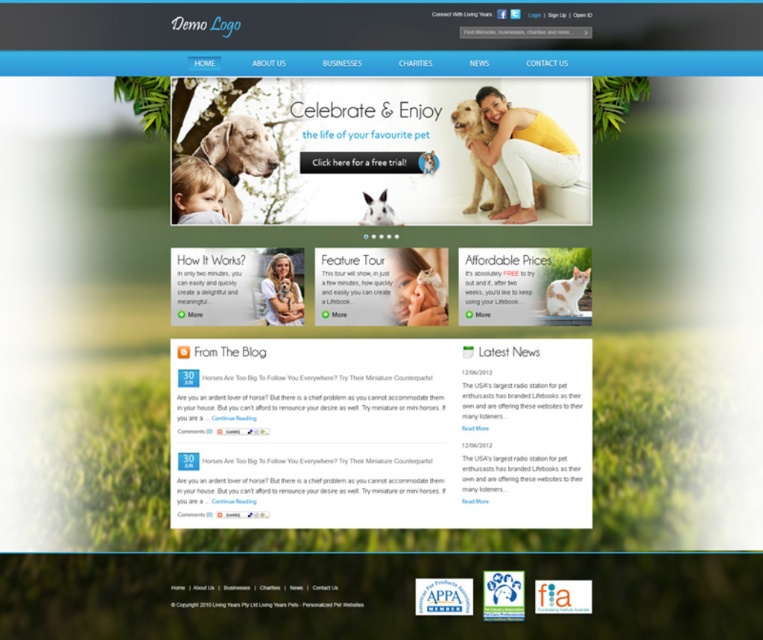
Question: Is matte gray dog at upper left to the left of white fur dog at right from the viewer's perspective?

Choices:
 (A) yes
 (B) no

Answer: (A)

Question: Which point is farther to the camera?

Choices:
 (A) (562, 308)
 (B) (398, 138)
 (C) (491, 131)
 (D) (385, 204)

Answer: (D)

Question: In this image, where is matte gray dog at upper left located relative to golden fur dog at center?

Choices:
 (A) below
 (B) above

Answer: (A)

Question: Can you confirm if golden fur dog at center is smaller than white fur dog at center?

Choices:
 (A) yes
 (B) no

Answer: (B)

Question: Which of the following is the farthest from the observer?

Choices:
 (A) (572, 285)
 (B) (372, 132)

Answer: (B)

Question: Which of the following is the closest to the observer?

Choices:
 (A) golden fur dog at center
 (B) matte gray dog at upper left
 (C) white glossy text at center
 (D) white fur dog at right

Answer: (B)